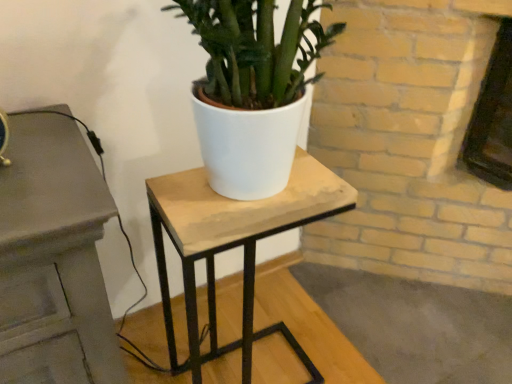
Question: From a real-world perspective, is wooden table at center physically located above or below white matte pot at center?

Choices:
 (A) below
 (B) above

Answer: (A)

Question: Relative to white matte pot at center, is wooden table at center in front or behind?

Choices:
 (A) front
 (B) behind

Answer: (B)

Question: Do you think wooden table at center is within white matte pot at center, or outside of it?

Choices:
 (A) inside
 (B) outside

Answer: (B)

Question: Would you say white matte pot at center is inside or outside wooden table at center?

Choices:
 (A) outside
 (B) inside

Answer: (A)

Question: Considering their positions, is white matte pot at center located in front of or behind wooden table at center?

Choices:
 (A) behind
 (B) front

Answer: (B)

Question: From a real-world perspective, relative to wooden table at center, is white matte pot at center vertically above or below?

Choices:
 (A) above
 (B) below

Answer: (A)

Question: Is white matte pot at center wider or thinner than wooden table at center?

Choices:
 (A) wide
 (B) thin

Answer: (B)